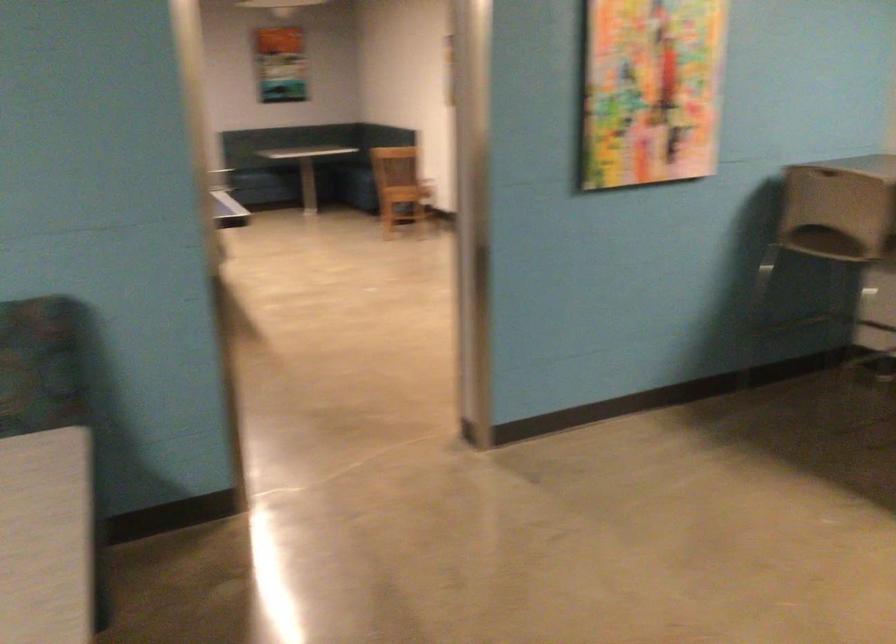
Where is `chair sitting surface`? Image resolution: width=896 pixels, height=644 pixels. chair sitting surface is located at coordinates (407, 192).